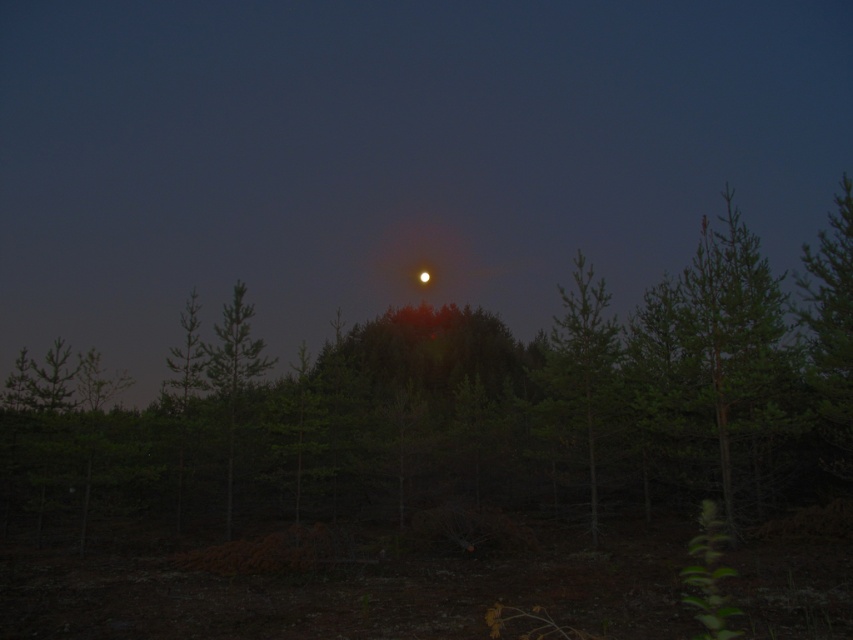
Question: Can you confirm if green matte tree at center is positioned to the right of green matte tree at right?

Choices:
 (A) yes
 (B) no

Answer: (A)

Question: Can you confirm if bright yellow moon at center is smaller than green matte tree at right?

Choices:
 (A) yes
 (B) no

Answer: (B)

Question: Among these points, which one is nearest to the camera?

Choices:
 (A) (239, 292)
 (B) (497, 164)
 (C) (613, 321)

Answer: (C)

Question: Among these objects, which one is nearest to the camera?

Choices:
 (A) green matte tree at left
 (B) green matte tree at center
 (C) green matte tree at right
 (D) bright yellow moon at center

Answer: (B)

Question: Among these points, which one is farthest from the camera?

Choices:
 (A) (589, 412)
 (B) (180, 456)
 (C) (90, 120)
 (D) (221, 342)

Answer: (C)

Question: Where is green matte tree at center located in relation to green matte tree at right in the image?

Choices:
 (A) left
 (B) right

Answer: (B)